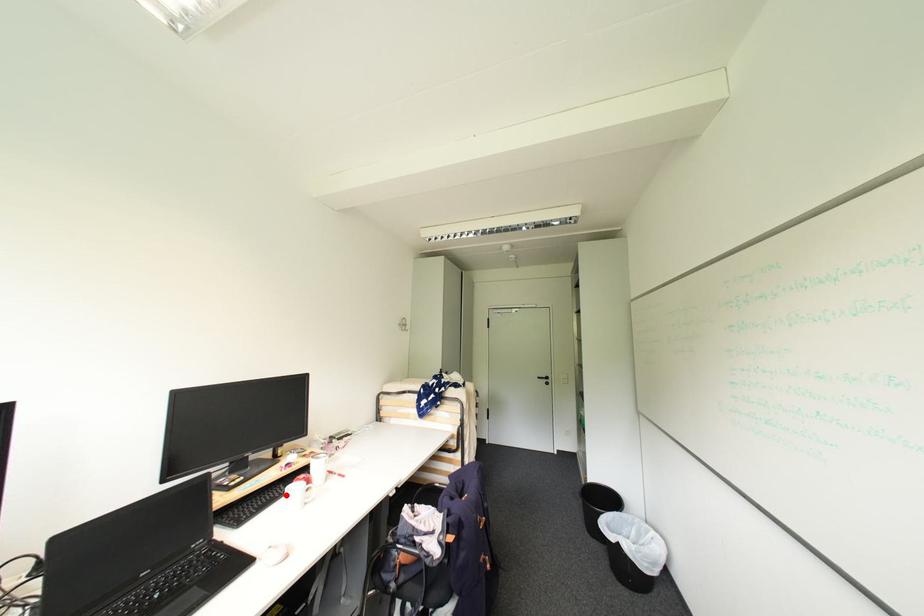
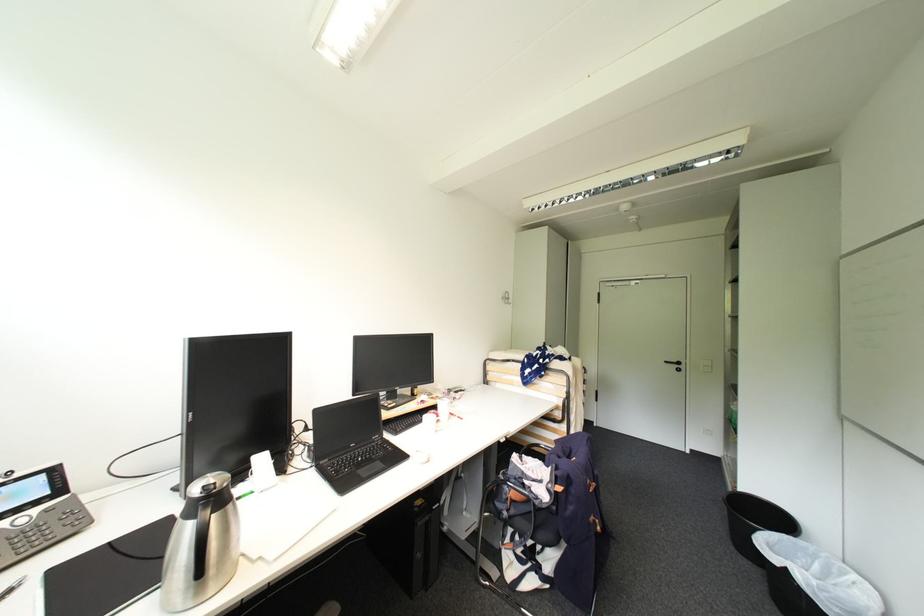
Find the pixel in the second image that matches the highlighted location in the first image.

(424, 421)